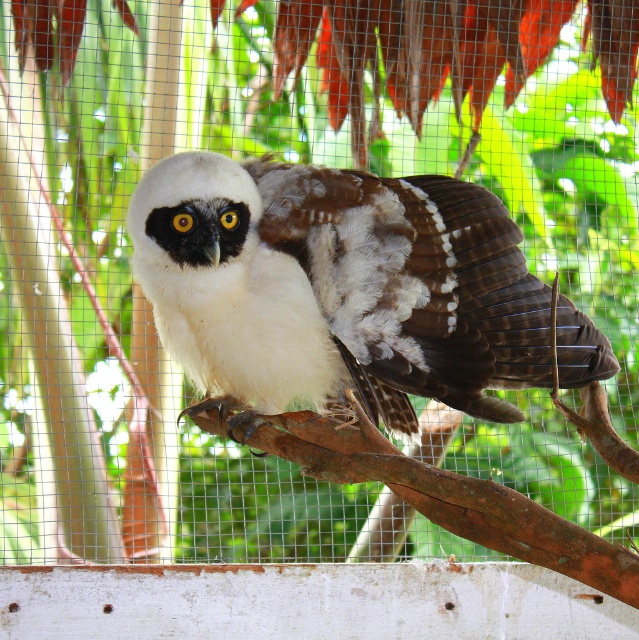
You are a photographer trying to capture the bird in the cage. You notice two points marked in the image at coordinates point (427,358) and point (288,445). Which point is closer to your camera lens?

Point (427,358) is closer to the camera than point (288,445).

You are a birdwatcher observing the scene. You notice the white soft feathers at center and the brown rough tree branch at center. Which object is positioned higher in the image?

The white soft feathers at center is located above the brown rough tree branch at center, so it is positioned higher in the image.